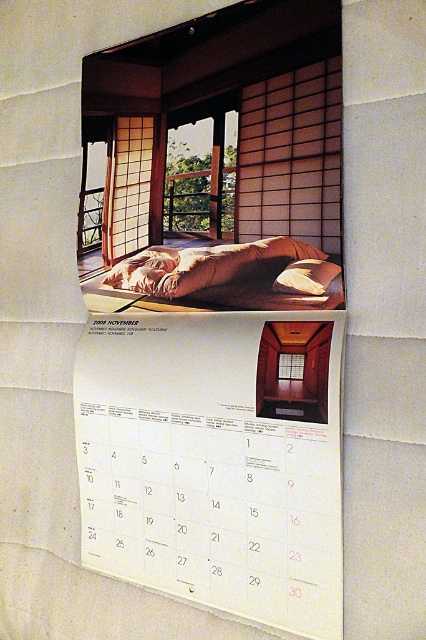
You are standing in front of the wall calendar for November 2004. There is a point labeled at coordinates point (x=305, y=586). If you want to place a 20 inch wide picture frame exactly at this point, will it fit without overlapping the edges of the calendar?

The point labeled at coordinates point (x=305, y=586) is 25.10 inches away from the edge of the calendar. Since the picture frame is 20 inches wide, placing it at this point would leave enough space on all sides, so it will fit without overlapping the edges of the calendar.